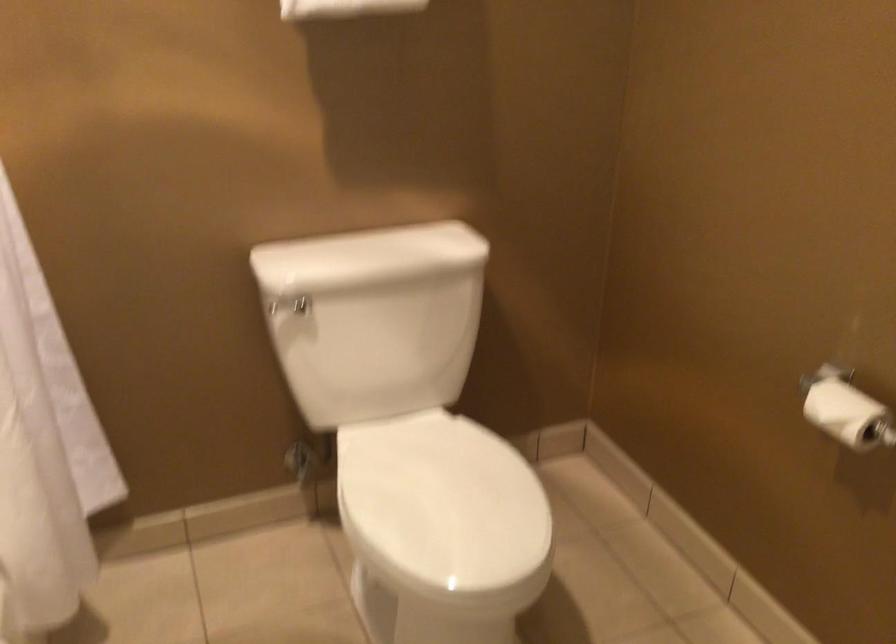
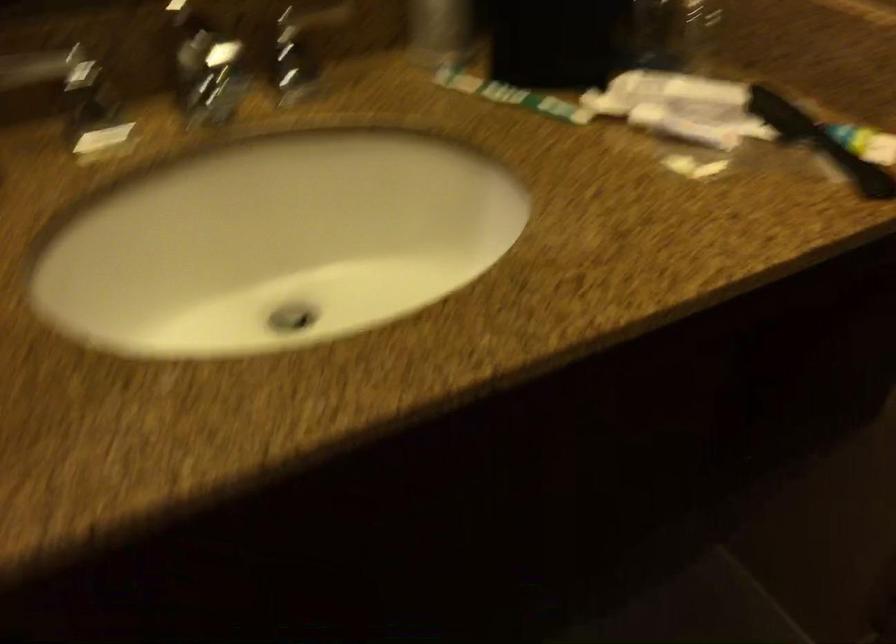
Based on the continuous images, in which direction is the camera rotating?

The camera rotated toward right-down.